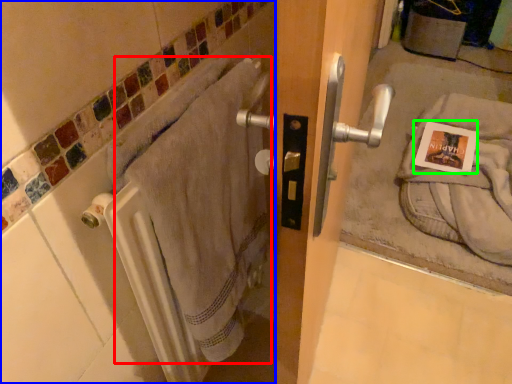
Question: Estimate the real-world distances between objects in this image. Which object is farther from bath towel (highlighted by a red box), bath (highlighted by a blue box) or postcard (highlighted by a green box)?

Choices:
 (A) bath
 (B) postcard

Answer: (B)